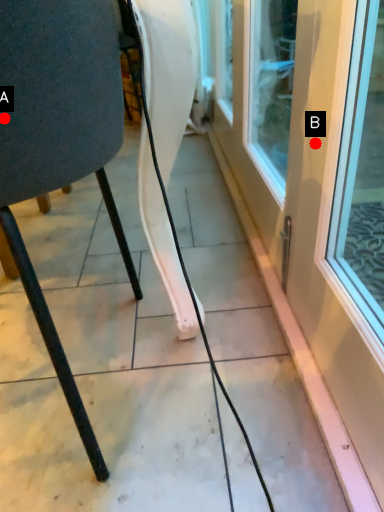
Question: Two points are circled on the image, labeled by A and B beside each circle. Among these points, which one is farthest from the camera?

Choices:
 (A) A is further
 (B) B is further

Answer: (B)